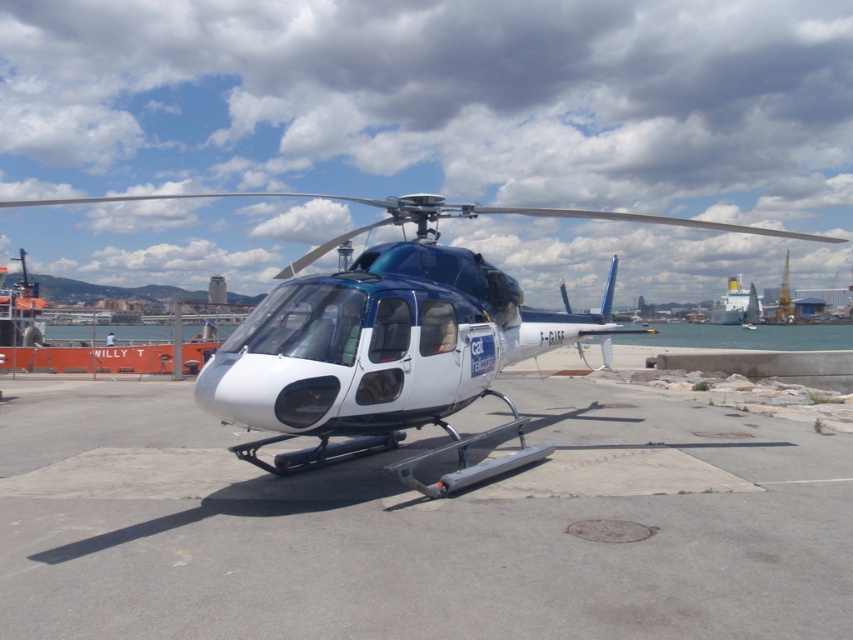
You are standing in front of the white concrete tarmac at center and the white glossy helicopter at center. Which object is nearer to you?

The white concrete tarmac at center is closer to the viewer than the white glossy helicopter at center, so the white concrete tarmac at center is nearer to you.

You are standing at the red barrier with the text WIL and want to walk to the helicopter. There are two points marked as point (705,547) and point (746,300). Which point should you walk towards to reach the helicopter first?

You should walk towards point (705,547) because it is in front of point (746,300), meaning it is closer to the helicopter.